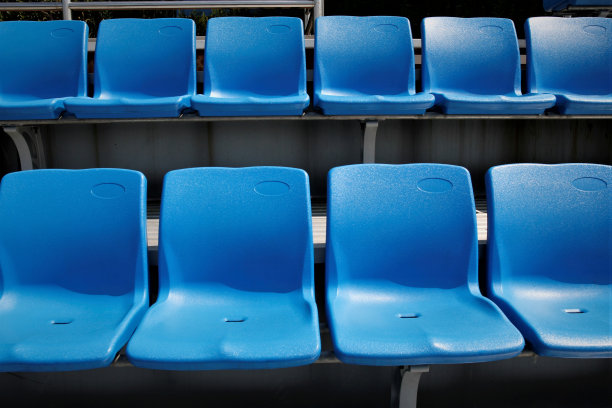
Locate an element on the screen. Image resolution: width=612 pixels, height=408 pixels. blue seats is located at coordinates (94, 248), (264, 241), (431, 243), (584, 241), (570, 64), (469, 73), (382, 64), (242, 73), (144, 70), (54, 59).